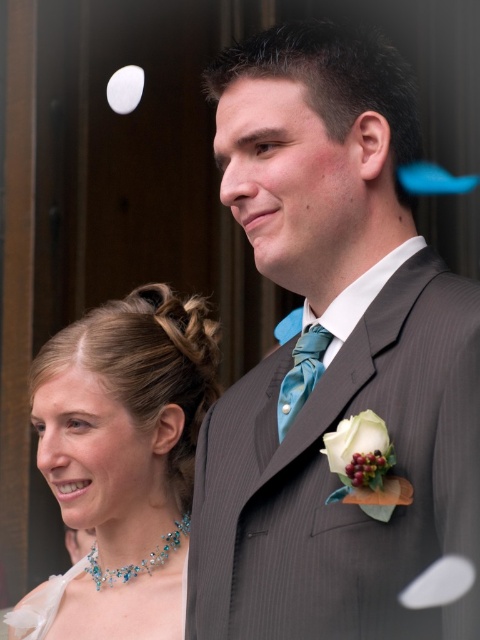
Question: Can you confirm if pearl necklace at upper left is positioned to the right of shiny blue beaded necklace at lower left?

Choices:
 (A) no
 (B) yes

Answer: (B)

Question: Which point appears farthest from the camera in this image?

Choices:
 (A) (48, 614)
 (B) (279, 412)
 (C) (269, 188)
 (D) (180, 518)

Answer: (D)

Question: Is gray pinstripe suit at center to the left of teal satin tie at center from the viewer's perspective?

Choices:
 (A) yes
 (B) no

Answer: (B)

Question: Can you confirm if teal satin tie at center is positioned below shiny blue gemstone necklace at lower left?

Choices:
 (A) yes
 (B) no

Answer: (B)

Question: Which of the following is the closest to the observer?

Choices:
 (A) shiny blue beaded necklace at lower left
 (B) gray pinstripe suit at center
 (C) teal satin tie at center

Answer: (B)

Question: Based on their relative distances, which object is nearer to the shiny blue gemstone necklace at lower left?

Choices:
 (A) shiny blue beaded necklace at lower left
 (B) teal satin tie at center

Answer: (A)